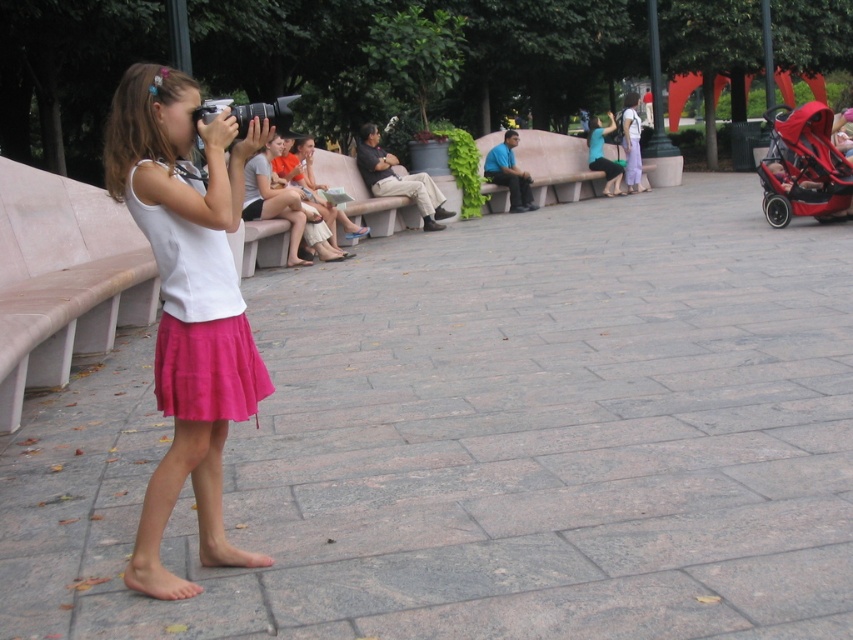
Question: Which of the following is the farthest from the observer?

Choices:
 (A) white cotton shirt at left
 (B) matte teal blouse at center
 (C) pink satin skirt at left

Answer: (B)

Question: Which object is the closest to the matte teal blouse at center?

Choices:
 (A) pink satin skirt at left
 (B) blue fabric shirt at center
 (C) matte white blouse at center
 (D) red matte baby carriage at right

Answer: (B)

Question: Is white cotton shirt at left bigger than blue fabric shirt at center?

Choices:
 (A) yes
 (B) no

Answer: (B)

Question: Estimate the real-world distances between objects in this image. Which object is farther from the purple cotton dress at center?

Choices:
 (A) matte teal blouse at center
 (B) white cotton shirt at left

Answer: (B)

Question: Is pink satin skirt at left behind blue fabric shirt at center?

Choices:
 (A) yes
 (B) no

Answer: (B)

Question: Can you confirm if pink satin skirt at left is thinner than purple cotton dress at center?

Choices:
 (A) yes
 (B) no

Answer: (A)